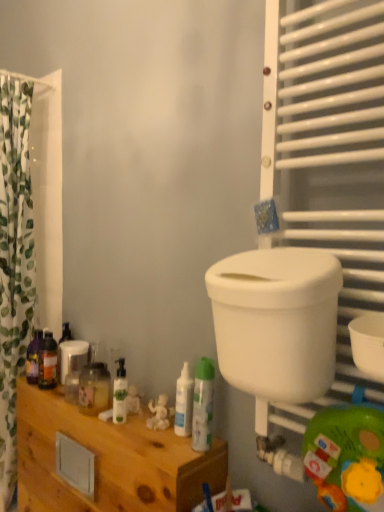
I want to click on vacant space positioned to the left of white glossy bottle at center, acting as the 2th toiletry starting from the front, so click(x=139, y=431).